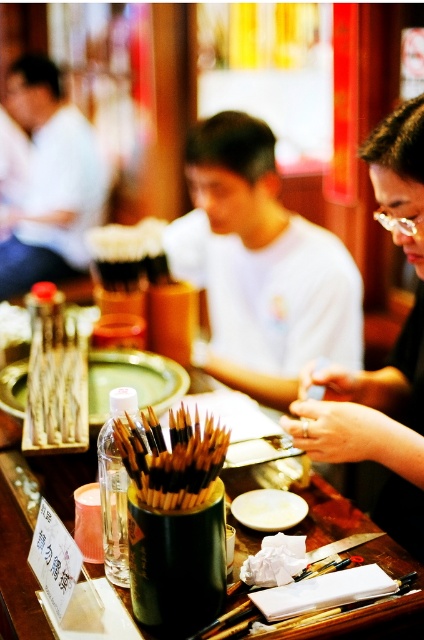
You are an observer looking at the scene described. Where is the matte white shirt at center located in terms of its 2D coordinates?

The matte white shirt at center is located at the 2D coordinates point (261, 266).

From the picture: You are organizing a calligraphy class and need to place a new set of brushes between the matte white shirt at center and the white ceramic plate at center. Which object should you place the brushes closer to if the brushes require more space than the plate?

The brushes should be placed closer to the matte white shirt at center because its width surpasses that of the white ceramic plate at center, providing more space.